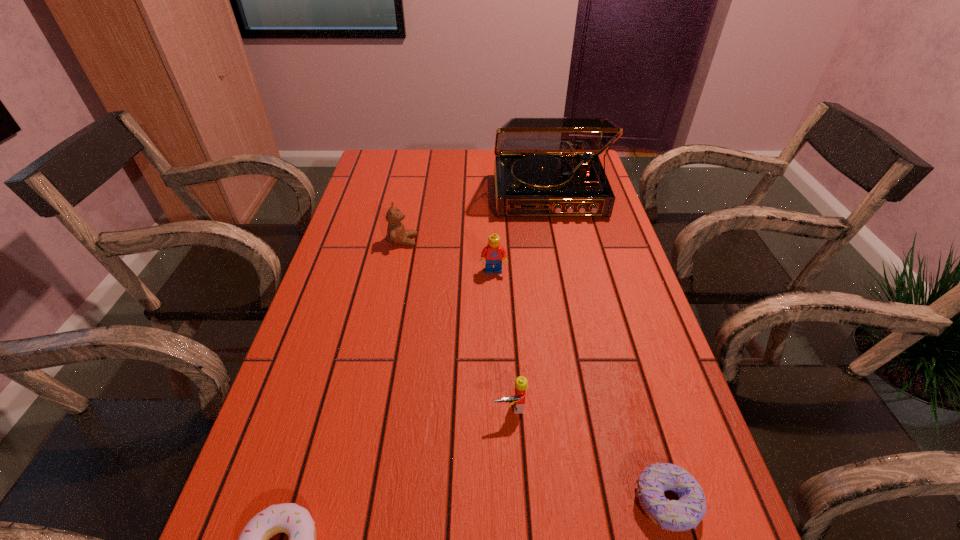
Find the location of a particular element. Image resolution: width=960 pixels, height=540 pixels. vacant space located 0.350m on the face of the third farthest object is located at coordinates (497, 395).

Identify the location of blank space located 0.070m in front of the fourth farthest object with the accessory visible. (513, 455).

The image size is (960, 540). I want to click on free location located on the left of the right doughnut, so click(x=544, y=502).

At what (x,y) coordinates should I click in order to perform the action: click on object present at the far edge. Please return your answer as a coordinate pair (x, y). This screenshot has width=960, height=540. Looking at the image, I should click on (544, 167).

Find the location of a particular element. Image resolution: width=960 pixels, height=540 pixels. object at the left edge is located at coordinates (396, 233).

Image resolution: width=960 pixels, height=540 pixels. Find the location of `record player at the right edge`. record player at the right edge is located at coordinates (544, 167).

The width and height of the screenshot is (960, 540). In order to click on doughnut positioned at the right edge in this screenshot , I will do `click(686, 513)`.

This screenshot has height=540, width=960. I want to click on object present at the far right corner, so point(544,167).

Find the location of a particular element. The image size is (960, 540). vacant space at the far edge of the desktop is located at coordinates (491, 178).

Locate an element on the screen. vacant space at the left edge of the desktop is located at coordinates (334, 403).